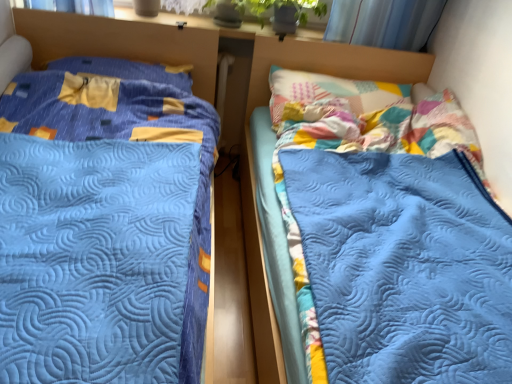
Question: Considering their positions, is yellow fabric pillow at upper left located in front of or behind blue quilted bed at left, placed as the 2th bed when sorted from right to left?

Choices:
 (A) front
 (B) behind

Answer: (B)

Question: From the image's perspective, is yellow fabric pillow at upper left located above or below blue quilted bed at left, placed as the first bed when sorted from left to right?

Choices:
 (A) above
 (B) below

Answer: (A)

Question: Which object is the closest to the yellow fabric pillow at upper left?

Choices:
 (A) blue quilted bed at left, placed as the 2th bed when sorted from right to left
 (B) blue quilted bed at center, the 2th bed from the left

Answer: (A)

Question: Which object is positioned farthest from the blue quilted bed at left, placed as the 2th bed when sorted from right to left?

Choices:
 (A) yellow fabric pillow at upper left
 (B) blue quilted bed at center, placed as the first bed when sorted from right to left

Answer: (B)